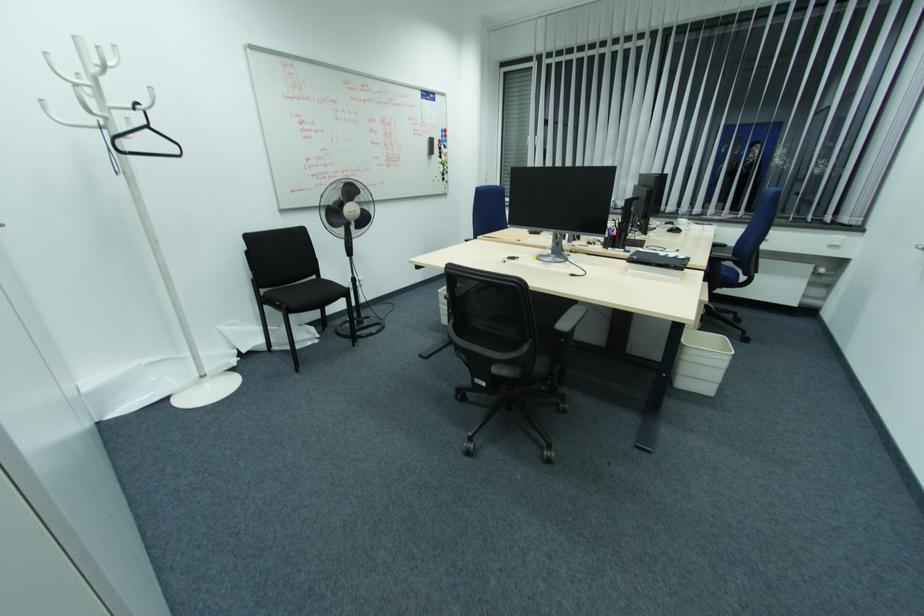
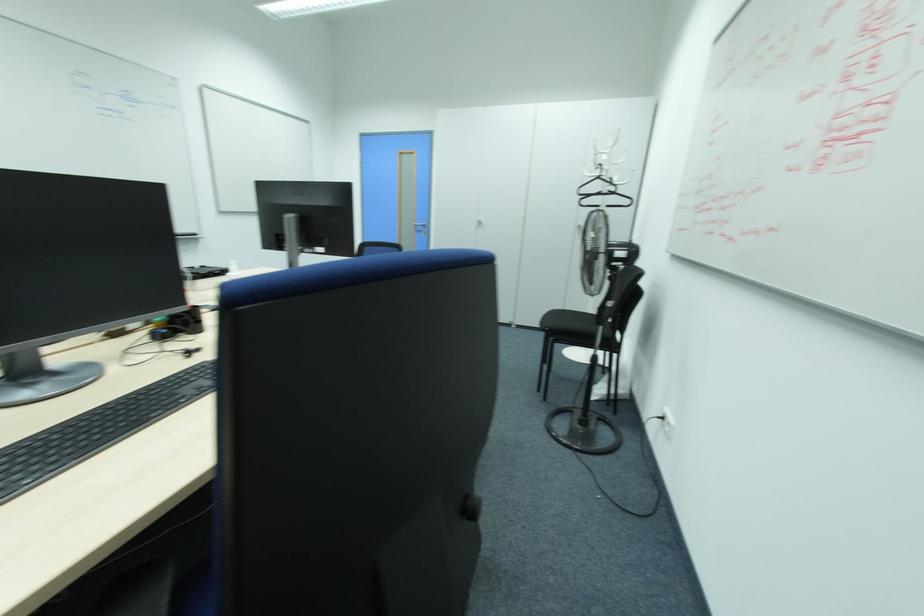
Question: I am providing you with two images of the same scene from different viewpoints. Please identify which objects are invisible in image2.

Choices:
 (A) black adjustment knob
 (B) white coat hook
 (C) metal door handle
 (D) none of these

Answer: (D)